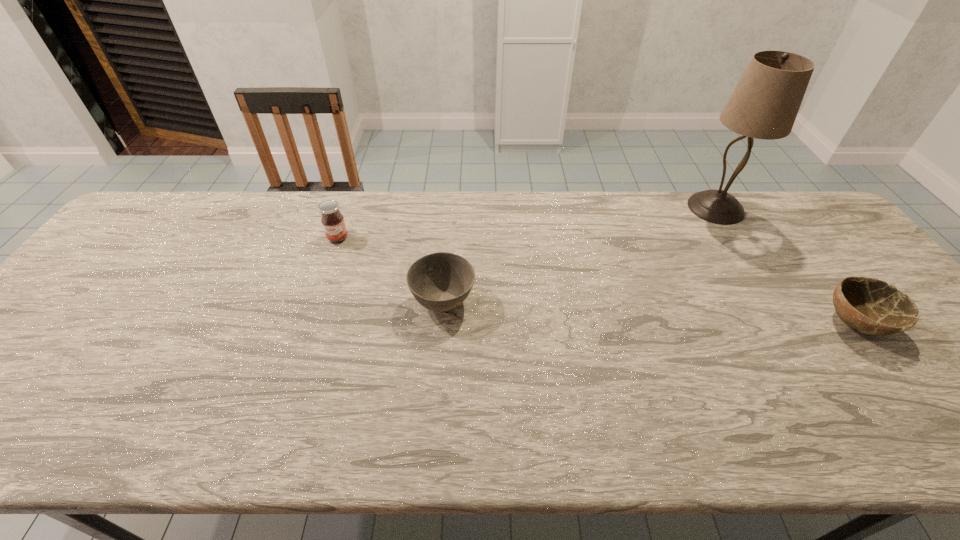
Find the location of `free location at the near right corner`. free location at the near right corner is located at coordinates (939, 427).

Where is `blank region between the rightmost object and the left bowl`? The width and height of the screenshot is (960, 540). blank region between the rightmost object and the left bowl is located at coordinates (650, 312).

Find the location of a particular element. Image resolution: width=960 pixels, height=540 pixels. empty space between the lampshade and the left bowl is located at coordinates point(580,255).

At what (x,y) coordinates should I click in order to perform the action: click on empty space that is in between the lampshade and the rightmost object. Please return your answer as a coordinate pair (x, y). The width and height of the screenshot is (960, 540). Looking at the image, I should click on (786, 266).

Locate an element on the screen. Image resolution: width=960 pixels, height=540 pixels. free space between the third shortest object and the left bowl is located at coordinates (391, 269).

Image resolution: width=960 pixels, height=540 pixels. What are the coordinates of `vacant space that's between the farthest object and the left bowl` in the screenshot? It's located at 580,255.

At what (x,y) coordinates should I click in order to perform the action: click on free space between the third object from left to right and the right bowl. Please return your answer as a coordinate pair (x, y). The height and width of the screenshot is (540, 960). Looking at the image, I should click on (786, 266).

Identify the location of vacant point located between the lampshade and the third object from right to left. point(580,255).

Locate an element on the screen. free point between the lampshade and the left bowl is located at coordinates (580, 255).

Image resolution: width=960 pixels, height=540 pixels. I want to click on vacant area between the second tallest object and the tallest object, so click(527, 223).